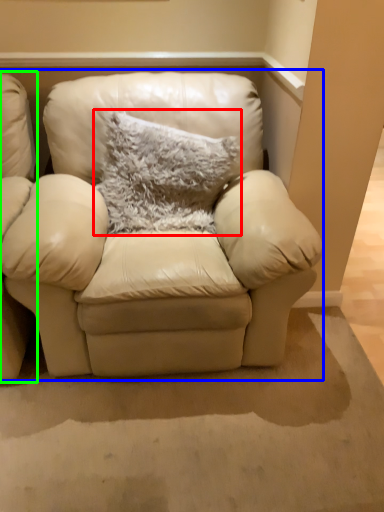
Question: Which object is positioned farthest from pillow (highlighted by a red box)? Select from studio couch (highlighted by a blue box) and chair (highlighted by a green box).

Choices:
 (A) studio couch
 (B) chair

Answer: (B)